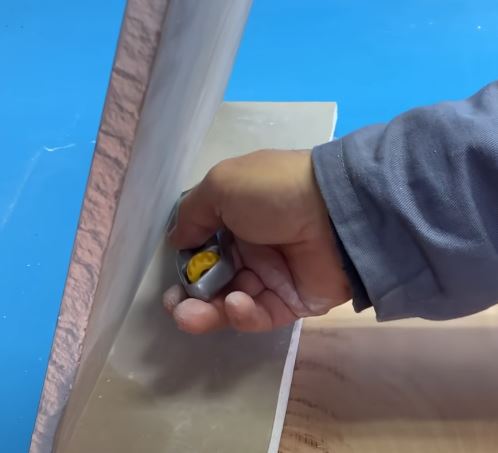
I want to click on gray colored sheetrock, so click(x=210, y=379).